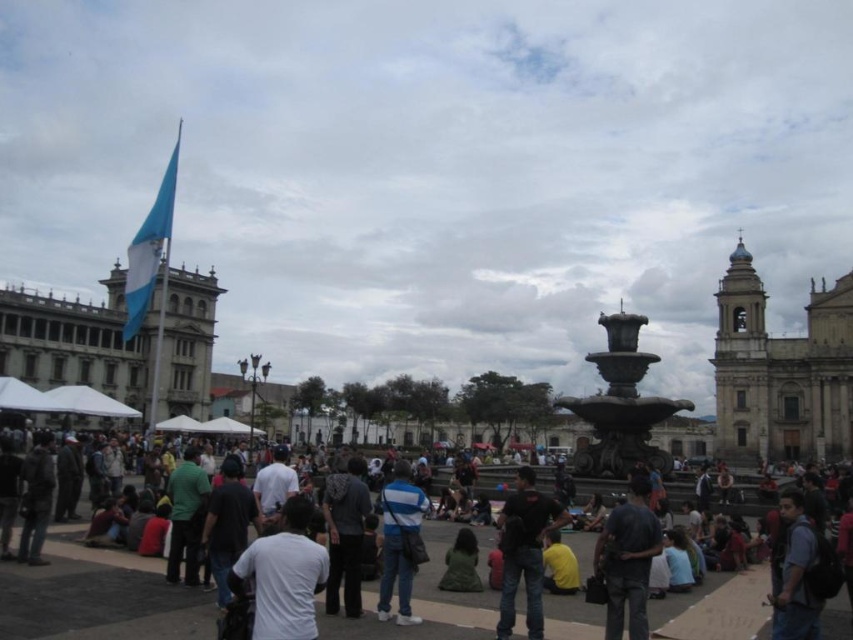
You are a photographer planning to capture a candid shot of the two people wearing dark blue jeans at center and dark blue shirt at center in the public square. Since you want to ensure both subjects are clearly visible, which clothing item would you focus on to ensure the entire person is in frame?

The dark blue jeans at center are wider than the dark blue shirt at center, so focusing on the wider dark blue jeans at center would ensure the entire person is captured in the frame.

You are standing at the center of the square and want to find the dark blue jeans at center. According to the coordinates provided, in which direction should you look to locate them?

You should look to the lower right direction since the dark blue jeans at center is located at point (97, 598), which is towards the lower right from the center.

You are standing in the public square and want to move from the flagpole to the fountain. There are two points marked on the path you need to cross. Which point is closer to you, point at coordinate (x=120, y=600) or point at coordinate (x=619, y=634)?

Point at coordinate (x=120, y=600) is closer to you because it is further to the viewer than point at coordinate (x=619, y=634).